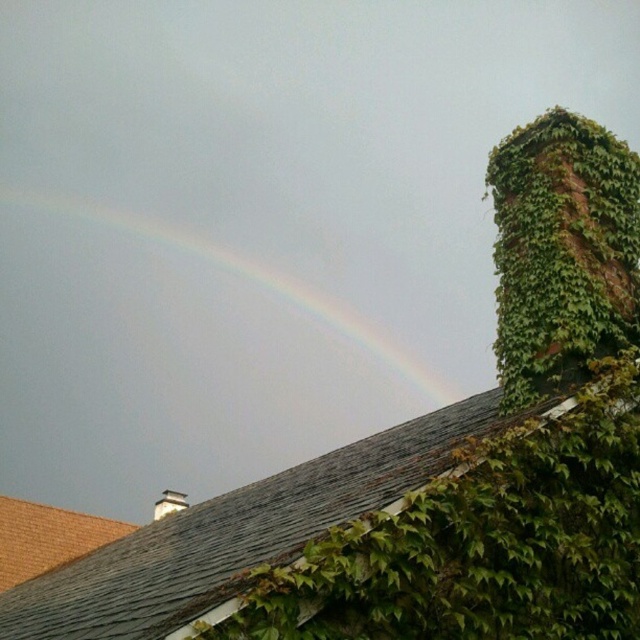
You are standing in the garden and looking at the green leafy ivy at upper right and the white brick chimney at upper center. Which object is closer to you?

The green leafy ivy at upper right is closer to you because it is in front of the white brick chimney at upper center.